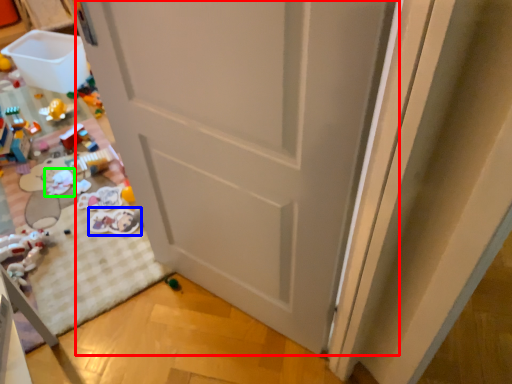
Question: Based on their relative distances, which object is farther from door (highlighted by a red box)? Choose from toy (highlighted by a blue box) and toy (highlighted by a green box).

Choices:
 (A) toy
 (B) toy

Answer: (B)